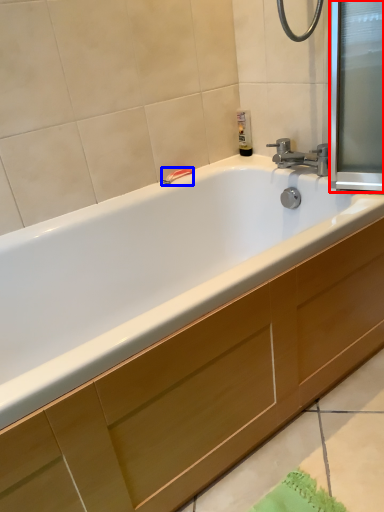
Question: Which point is further to the camera, screen door (highlighted by a red box) or towel bar (highlighted by a blue box)?

Choices:
 (A) screen door
 (B) towel bar

Answer: (B)